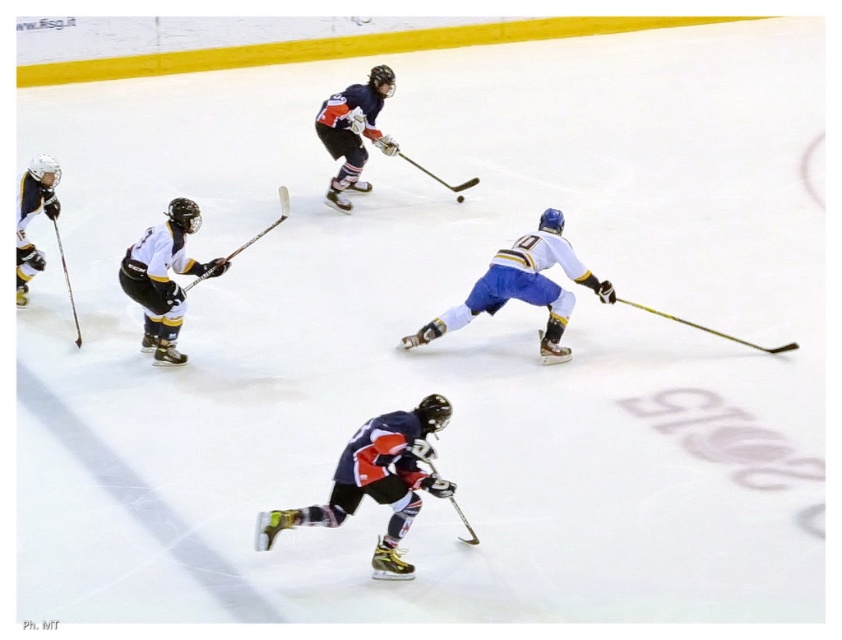
Question: Observing the image, what is the correct spatial positioning of shiny black hockey stick at center in reference to shiny black hockey stick at left?

Choices:
 (A) left
 (B) right

Answer: (B)

Question: In this image, where is yellow matte hockey stick at lower right located relative to shiny black hockey stick at center?

Choices:
 (A) right
 (B) left

Answer: (A)

Question: Which point is closer to the camera?

Choices:
 (A) shiny black hockey stick at center
 (B) shiny black hockey stick at left

Answer: (B)

Question: Which of the following is the farthest from the observer?

Choices:
 (A) (440, 179)
 (B) (65, 282)

Answer: (A)

Question: Which of the following is the closest to the observer?

Choices:
 (A) (393, 148)
 (B) (776, 349)

Answer: (B)

Question: Is yellow matte hockey stick at lower right below shiny black hockey stick at left?

Choices:
 (A) yes
 (B) no

Answer: (A)